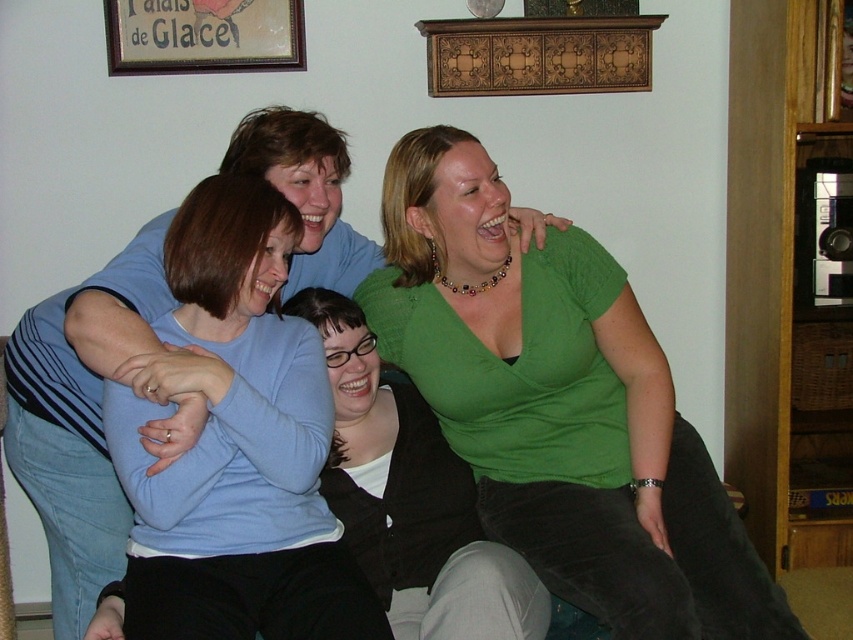
You are a photographer trying to capture a candid shot of the matte blue sweater at center without including the green matte shirt at upper right in the frame. Is this possible given their positions?

The matte blue sweater at center is behind the green matte shirt at upper right, so it would be obscured by the green matte shirt at upper right. Therefore, capturing the matte blue sweater at center without the green matte shirt at upper right in the frame is not possible.

You are a photographer trying to capture a candid shot of the green matte shirt at center and the wooden frame at upper center. Which object is positioned to the right side from your viewpoint?

→ The green matte shirt at center is to the right of the wooden frame at upper center, so the green matte shirt at center is positioned to the right side from your viewpoint.